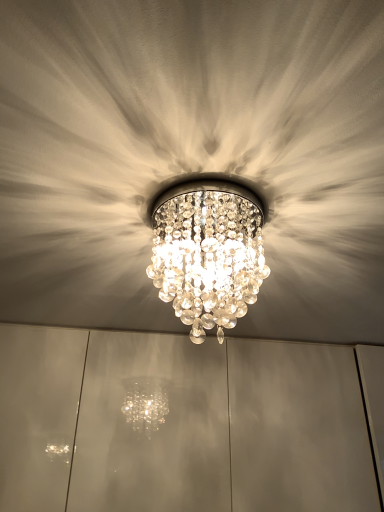
Locate an element on the screen. This screenshot has height=512, width=384. clear crystal chandelier at center is located at coordinates (208, 250).

Describe the element at coordinates (208, 250) in the screenshot. This screenshot has width=384, height=512. I see `clear crystal chandelier at center` at that location.

Identify the location of clear crystal chandelier at center. (208, 250).